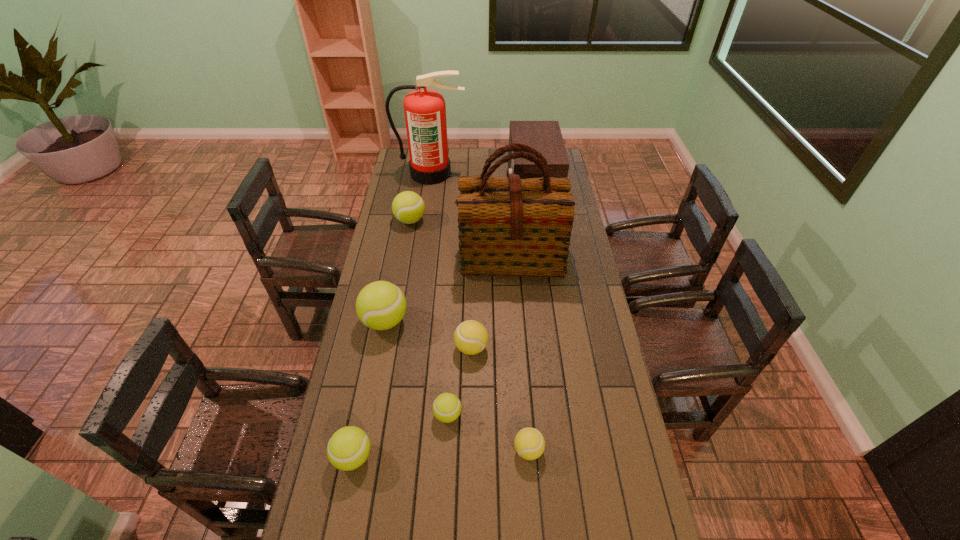
Where is `the smaller yellow tennis ball`? The width and height of the screenshot is (960, 540). the smaller yellow tennis ball is located at coordinates (529, 443).

Locate an element on the screen. This screenshot has height=540, width=960. the rightmost tennis ball is located at coordinates (529, 443).

The width and height of the screenshot is (960, 540). I want to click on the third farthest green tennis ball, so click(447, 407).

The height and width of the screenshot is (540, 960). Find the location of `the third nearest tennis ball`. the third nearest tennis ball is located at coordinates (447, 407).

At what (x,y) coordinates should I click in order to perform the action: click on free space located at the nozzle of the red fire extinguisher. Please return your answer as a coordinate pair (x, y). The width and height of the screenshot is (960, 540). Looking at the image, I should click on (427, 200).

Locate an element on the screen. The image size is (960, 540). vacant space located 0.160m on the open handle side of the shopping bag is located at coordinates (515, 314).

Where is `vacant space positioned on the front-facing side of the radio receiver`? The height and width of the screenshot is (540, 960). vacant space positioned on the front-facing side of the radio receiver is located at coordinates (485, 185).

Where is `free region located 0.320m on the front-facing side of the radio receiver`? This screenshot has width=960, height=540. free region located 0.320m on the front-facing side of the radio receiver is located at coordinates (443, 185).

This screenshot has width=960, height=540. Identify the location of free region located on the front-facing side of the radio receiver. (450, 185).

Where is `free space located 0.140m on the right of the tallest tennis ball`? Image resolution: width=960 pixels, height=540 pixels. free space located 0.140m on the right of the tallest tennis ball is located at coordinates [446, 321].